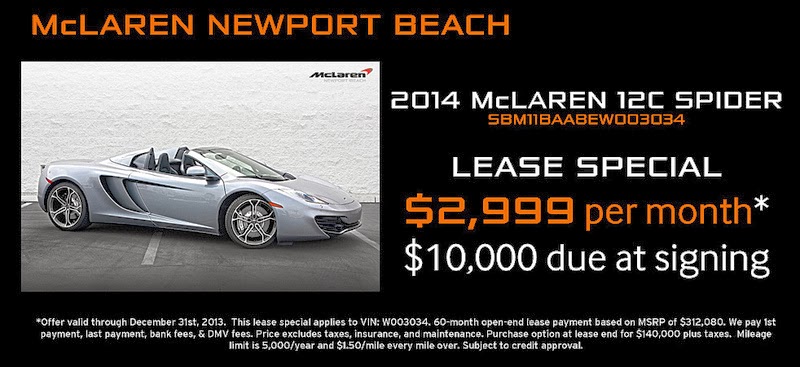
Where is `right door`? Image resolution: width=800 pixels, height=367 pixels. right door is located at coordinates click(178, 193).